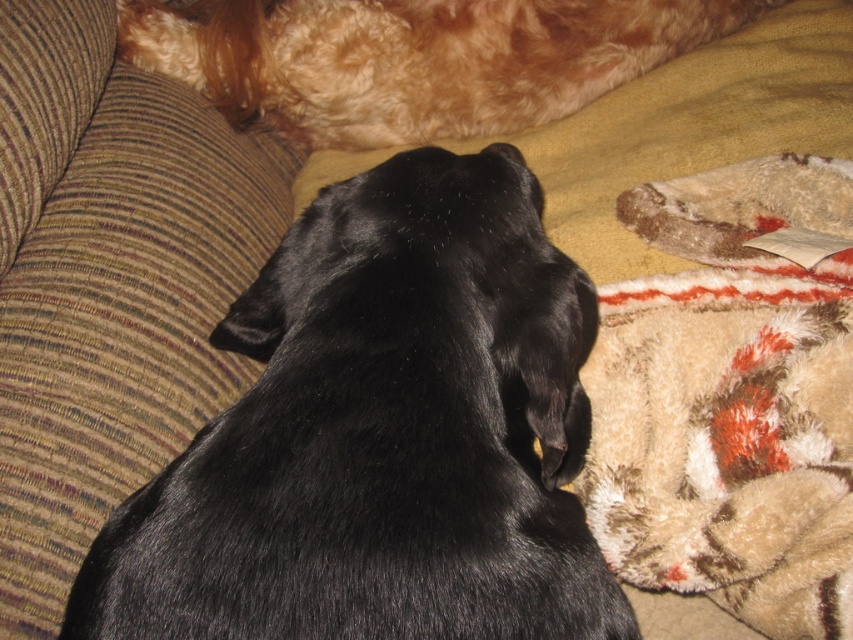
Between point (833, 458) and point (263, 113), which one is positioned behind?

The point (263, 113) is more distant.

Measure the distance between fuzzy beige blanket at lower right and camera.

fuzzy beige blanket at lower right is 25.87 inches from camera.

I want to click on fuzzy beige blanket at lower right, so (x=730, y=400).

Locate an element on the screen. fuzzy beige blanket at lower right is located at coordinates (730, 400).

Can you confirm if black fur dog at center is positioned to the left of fuzzy beige blanket at lower right?

Indeed, black fur dog at center is positioned on the left side of fuzzy beige blanket at lower right.

Is point (194, 468) closer to camera compared to point (787, 465)?

Yes, it is in front of point (787, 465).

This screenshot has height=640, width=853. I want to click on black fur dog at center, so click(x=381, y=435).

Can you confirm if black fur dog at center is positioned above golden fur dog at upper center?

No, black fur dog at center is not above golden fur dog at upper center.

Is black fur dog at center closer to camera compared to golden fur dog at upper center?

Yes, black fur dog at center is closer to the viewer.

At what (x,y) coordinates should I click in order to perform the action: click on black fur dog at center. Please return your answer as a coordinate pair (x, y). This screenshot has width=853, height=640. Looking at the image, I should click on (381, 435).